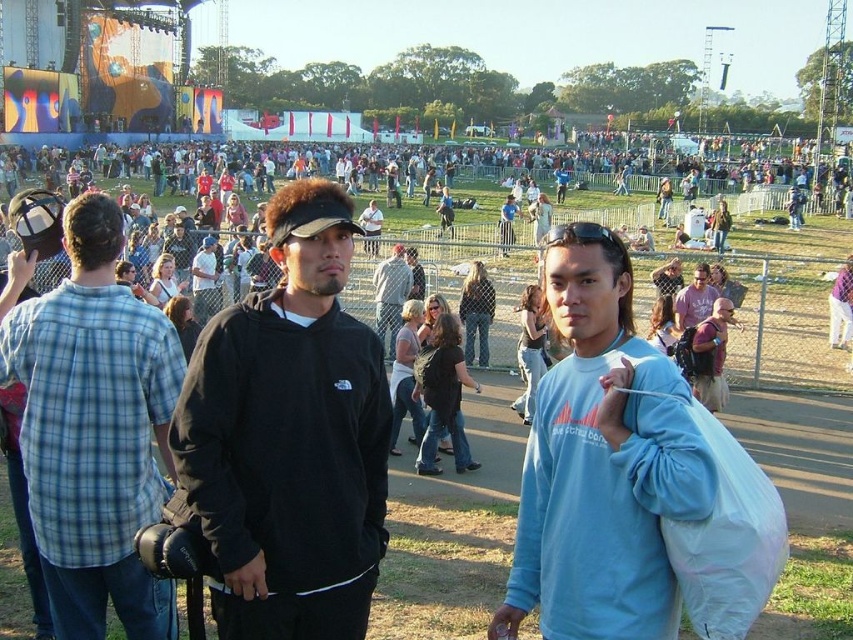
Does black matte sweatshirt at center have a lesser width compared to blue plaid shirt at left?

Correct, black matte sweatshirt at center's width is less than blue plaid shirt at left's.

What do you see at coordinates (289, 436) in the screenshot?
I see `black matte sweatshirt at center` at bounding box center [289, 436].

Image resolution: width=853 pixels, height=640 pixels. Find the location of `black matte sweatshirt at center`. black matte sweatshirt at center is located at coordinates (289, 436).

Measure the distance from black fabric jacket at center to white shirt at center.

black fabric jacket at center is 11.81 meters from white shirt at center.

Which is behind, point (386, 301) or point (201, 298)?

The point (201, 298) is behind.

The height and width of the screenshot is (640, 853). Find the location of `black fabric jacket at center`. black fabric jacket at center is located at coordinates (390, 296).

Does light blue sweatshirt at center appear on the left side of blue plaid shirt at left?

No, light blue sweatshirt at center is not to the left of blue plaid shirt at left.

Is light blue sweatshirt at center thinner than blue plaid shirt at left?

Indeed, light blue sweatshirt at center has a lesser width compared to blue plaid shirt at left.

Based on the photo, measure the distance between light blue sweatshirt at center and camera.

29.44 meters

Find the location of `light blue sweatshirt at center`. light blue sweatshirt at center is located at coordinates (601, 461).